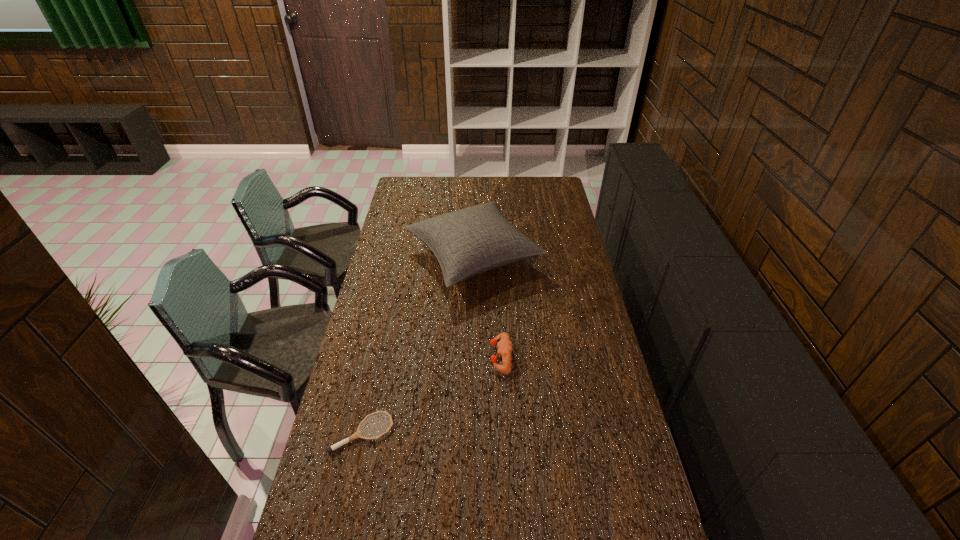
The height and width of the screenshot is (540, 960). I want to click on cushion, so click(x=467, y=242).

Find the location of a particular element. the tallest object is located at coordinates (467, 242).

You are a GUI agent. You are given a task and a screenshot of the screen. Output one action in this format:
    pyautogui.click(x=<x>, y=<y>)
    Task: Click on the puncher
    The width and height of the screenshot is (960, 540).
    Given the screenshot: What is the action you would take?
    pyautogui.click(x=505, y=347)

Identify the location of the second tallest object. (505, 347).

At what (x,y) coordinates should I click in order to perform the action: click on tennis racket. Please return your answer as a coordinate pair (x, y). Looking at the image, I should click on (357, 434).

Find the location of a particular element. the shortest object is located at coordinates (x=357, y=434).

The image size is (960, 540). I want to click on blank space located 0.180m on the front of the farthest object, so click(x=472, y=341).

I want to click on free space located 0.060m with the gloves of the second nearest object facing forward, so click(473, 356).

Find the location of a particular element. free space located 0.280m with the gloves of the second nearest object facing forward is located at coordinates (411, 356).

You are a GUI agent. You are given a task and a screenshot of the screen. Output one action in this format:
    pyautogui.click(x=<x>, y=<y>)
    Task: Click on the free spot located 0.110m with the gloves of the second nearest object facing forward
    This screenshot has height=540, width=960.
    Given the screenshot: What is the action you would take?
    pyautogui.click(x=459, y=356)